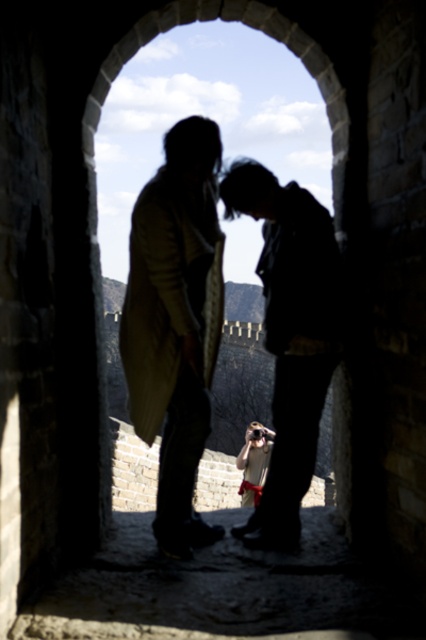
You are a photographer trying to capture the two figures under the stone archway. You notice the silhouette coat at center and the matte black jacket at center. Which of the two clothing items appears smaller in the photo?

The silhouette coat at center appears smaller than the matte black jacket at center in the photo.

You are a photographer trying to capture the two figures through the stone archway. You notice the silhouette clothing at center and the matte black jacket at center. Which clothing item is positioned to the left when you look through the camera?

The silhouette clothing at center is positioned on the left side of matte black jacket at center, so when looking through the camera, the silhouette clothing at center is to the left of the matte black jacket at center.